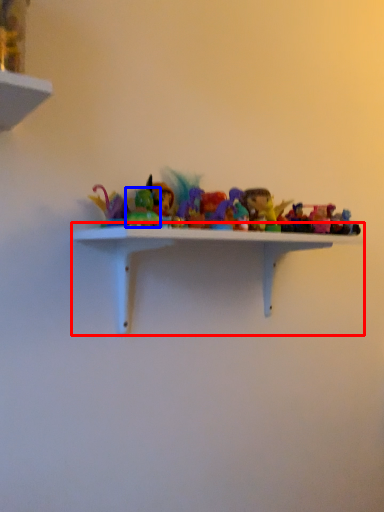
Question: Which point is closer to the camera, shelf (highlighted by a red box) or toy (highlighted by a blue box)?

Choices:
 (A) shelf
 (B) toy

Answer: (A)